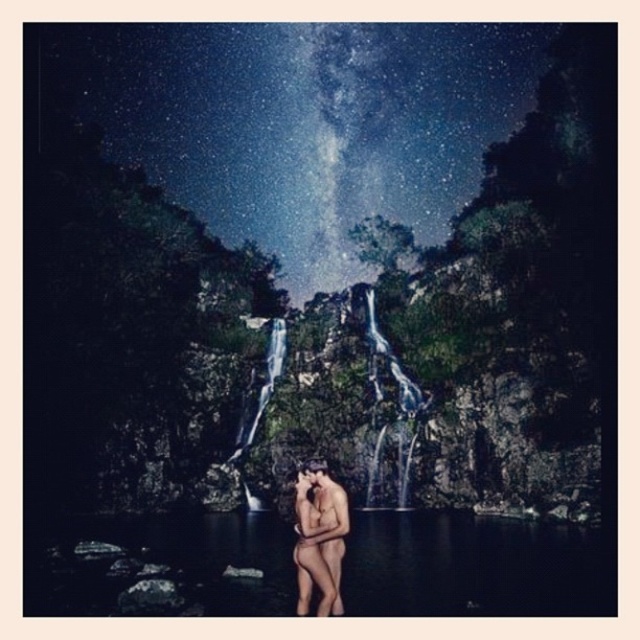
You are a photographer aiming to capture the Milky Way behind the couple. Based on their positions, where should you position your camera relative to the transparent water at center and the smooth skin man at center to ensure the Milky Way is fully visible?

The transparent water at center is located below the smooth skin man at center, so positioning the camera above the smooth skin man at center will ensure the Milky Way in the sky is fully visible without obstruction from the transparent water at center.

You are a photographer planning to capture the Milky Way in the background of a couple. You need to ensure the transparent water at center and smooth skin man at center are both visible. Which object should you focus on to ensure the Milky Way remains clear?

The transparent water at center is larger in size than the smooth skin man at center. To ensure the Milky Way remains clear, focus on the transparent water at center since it is larger and will help maintain the background clarity.